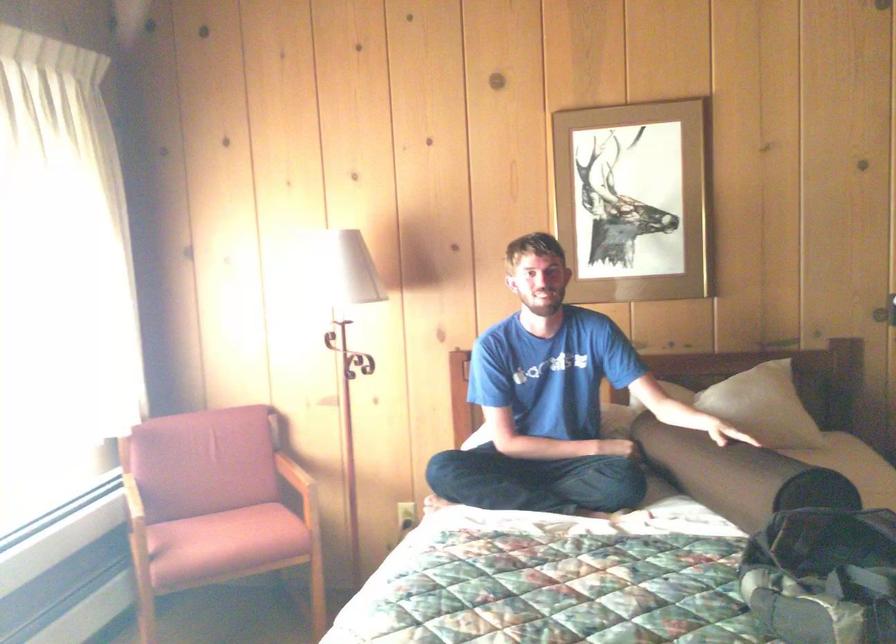
Locate an element on the screen. chair sitting surface is located at coordinates (224, 543).